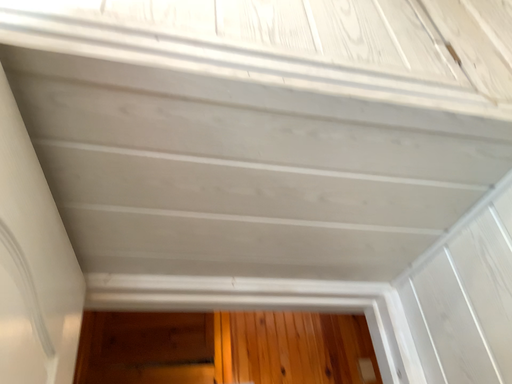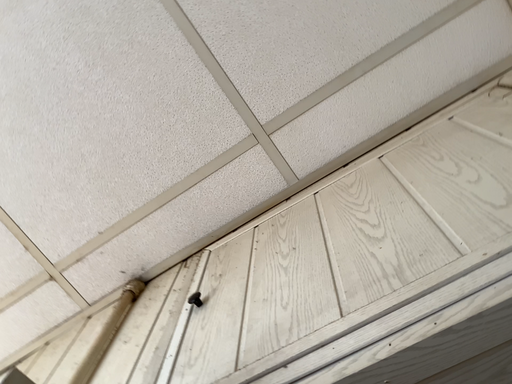
Question: How did the camera likely rotate when shooting the video?

Choices:
 (A) rotated upward
 (B) rotated downward

Answer: (A)